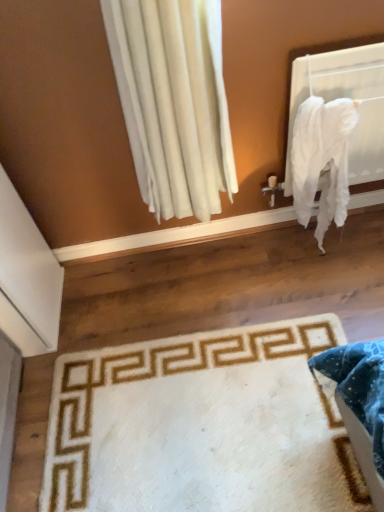
Locate an element on the screen. Image resolution: width=384 pixels, height=512 pixels. free location in front of white cotton blanket at right is located at coordinates (323, 292).